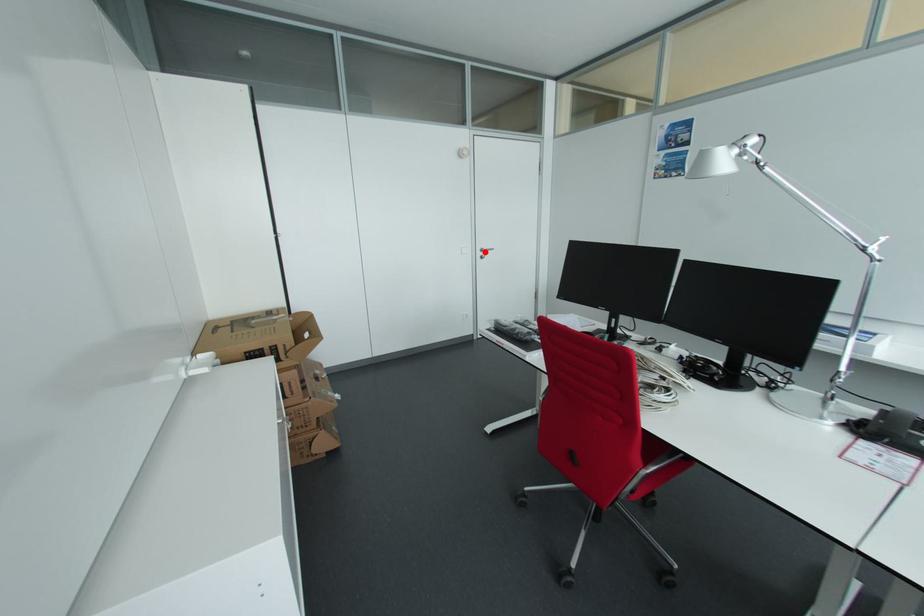
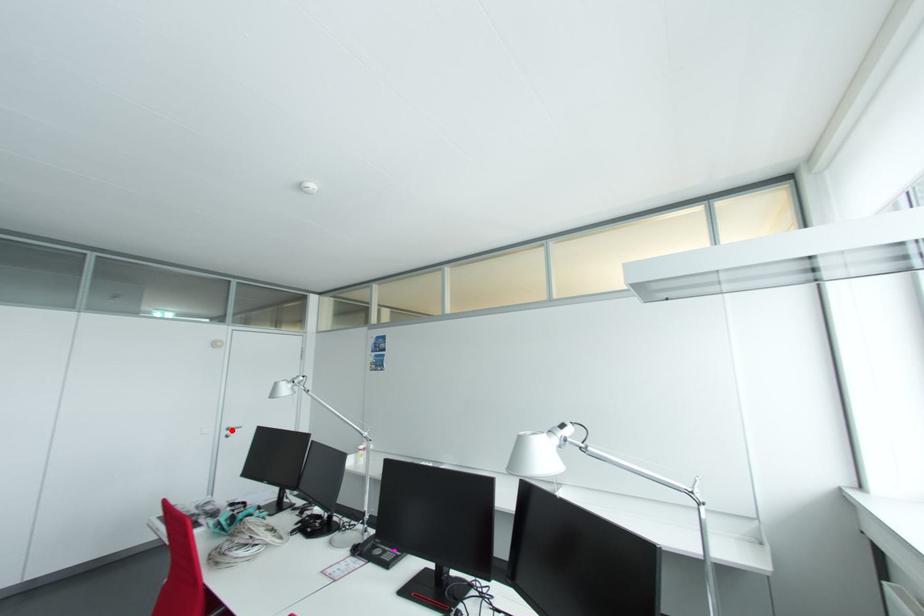
Looking at this image, I am providing you with two images of the same scene from different viewpoints. A red point is marked on the first image and another point is marked on the second image. Is the red point in image1 aligned with the point shown in image2?

Yes